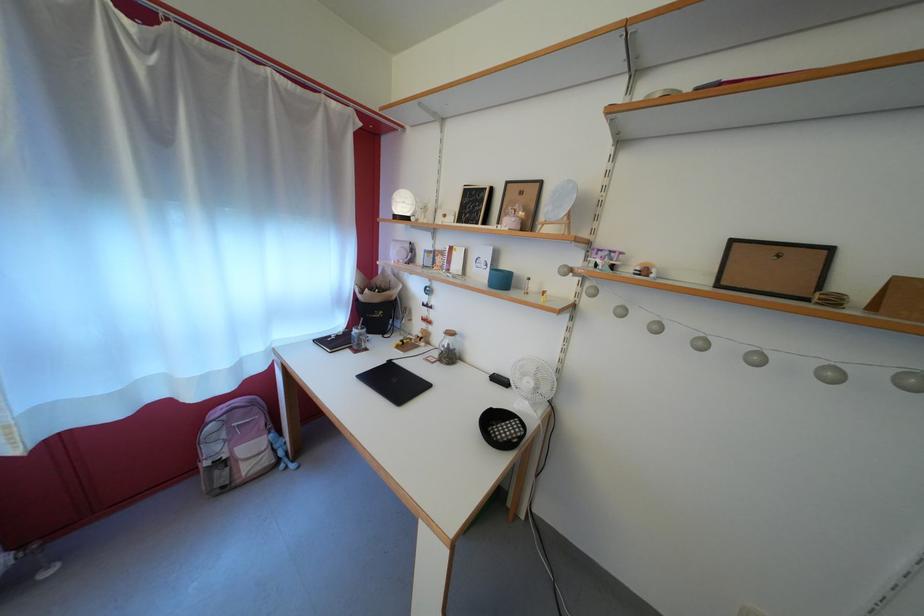
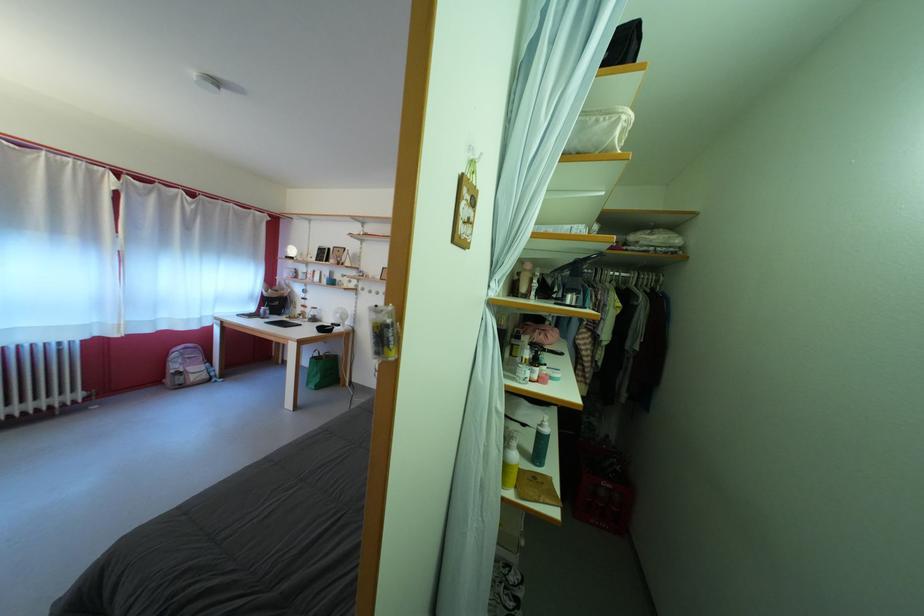
In the second image, find the point that corresponds to point 223,456 in the first image.

(184, 373)